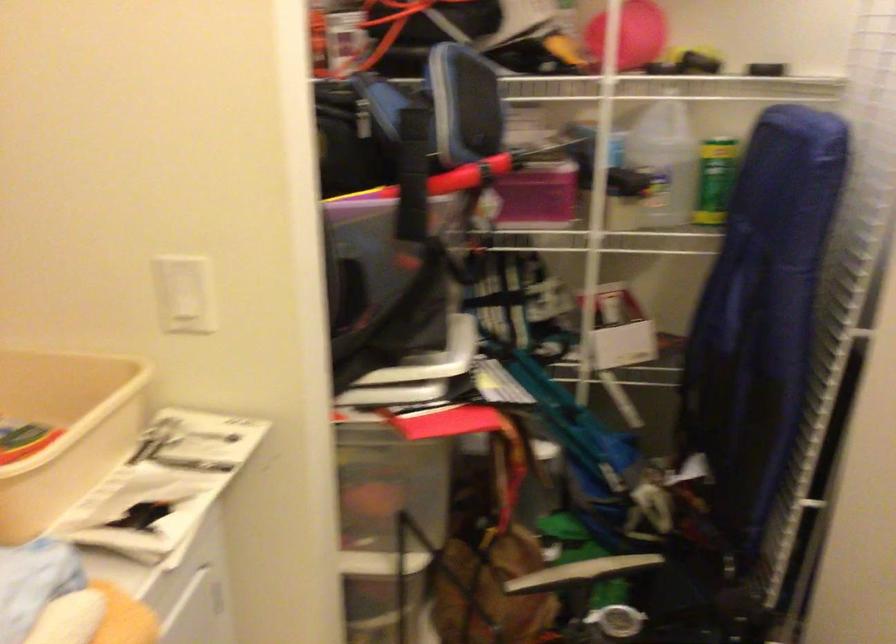
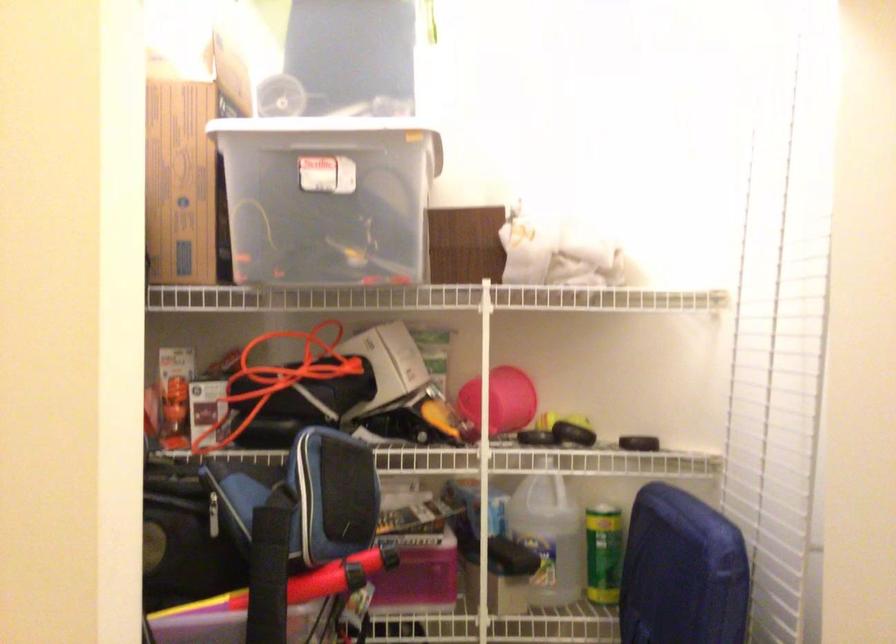
The point at (786,166) is marked in the first image. Where is the corresponding point in the second image?

(682, 572)